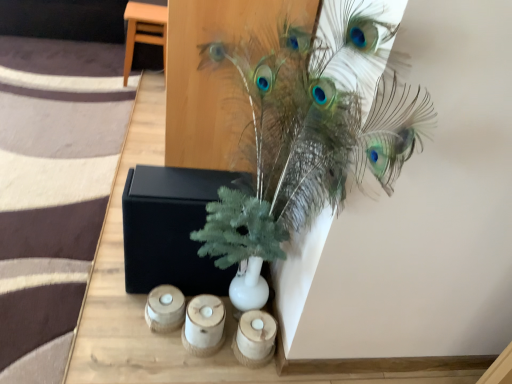
Question: From the image's perspective, is black matte box at center under light brown wood stool at upper left?

Choices:
 (A) no
 (B) yes

Answer: (B)

Question: Considering the relative positions of black matte box at center and light brown wood stool at upper left in the image provided, is black matte box at center in front of light brown wood stool at upper left?

Choices:
 (A) yes
 (B) no

Answer: (A)

Question: Is black matte box at center next to light brown wood stool at upper left and touching it?

Choices:
 (A) yes
 (B) no

Answer: (B)

Question: From a real-world perspective, is black matte box at center below light brown wood stool at upper left?

Choices:
 (A) yes
 (B) no

Answer: (A)

Question: Can you confirm if black matte box at center is taller than light brown wood stool at upper left?

Choices:
 (A) no
 (B) yes

Answer: (A)

Question: Considering their positions, is wooden candle holder at lower center, which is the third candle holder from right to left, located in front of or behind wooden candle holder at lower center, placed as the 1th candle holder when sorted from right to left?

Choices:
 (A) behind
 (B) front

Answer: (A)

Question: From the image's perspective, is wooden candle holder at lower center, positioned as the first candle holder in left-to-right order, above or below wooden candle holder at lower center, placed as the 1th candle holder when sorted from right to left?

Choices:
 (A) above
 (B) below

Answer: (A)

Question: Which is correct: wooden candle holder at lower center, positioned as the first candle holder in left-to-right order, is inside wooden candle holder at lower center, which is the 3th candle holder in left-to-right order, or outside of it?

Choices:
 (A) inside
 (B) outside

Answer: (B)

Question: From their relative heights in the image, would you say wooden candle holder at lower center, which is the third candle holder from right to left, is taller or shorter than wooden candle holder at lower center, which is the 3th candle holder in left-to-right order?

Choices:
 (A) short
 (B) tall

Answer: (A)

Question: Is point (159, 198) closer or farther from the camera than point (135, 38)?

Choices:
 (A) farther
 (B) closer

Answer: (B)

Question: From their relative heights in the image, would you say black matte box at center is taller or shorter than light brown wood stool at upper left?

Choices:
 (A) tall
 (B) short

Answer: (B)

Question: From a real-world perspective, is black matte box at center positioned above or below light brown wood stool at upper left?

Choices:
 (A) below
 (B) above

Answer: (A)

Question: Choose the correct answer: Is black matte box at center inside light brown wood stool at upper left or outside it?

Choices:
 (A) inside
 (B) outside

Answer: (B)

Question: Is black matte box at center taller or shorter than wooden candle holder at lower center, positioned as the first candle holder in left-to-right order?

Choices:
 (A) short
 (B) tall

Answer: (B)

Question: Considering the positions of point (133, 236) and point (172, 304), is point (133, 236) closer or farther from the camera than point (172, 304)?

Choices:
 (A) farther
 (B) closer

Answer: (B)